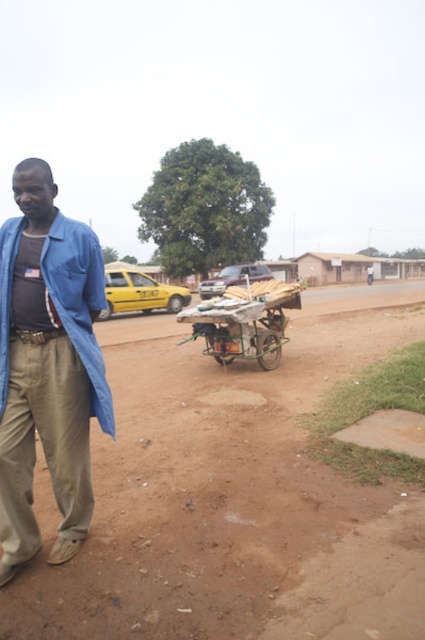
You are a traveler who needs to cross the brown dirt field at center and the wooden cart at center. Which one will you have to walk around because of its size?

The brown dirt field at center is larger in size than the wooden cart at center, so you will have to walk around the brown dirt field at center.

You are a traveler on the dirt road and you see the khaki cotton pants at lower left and the blue cotton jacket at lower left. Which one is positioned more to the left side?

The khaki cotton pants at lower left is positioned more to the left side than the blue cotton jacket at lower left.